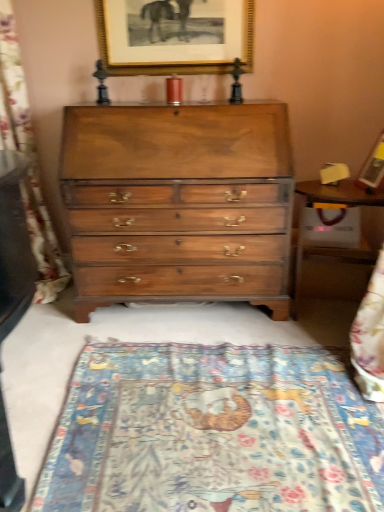
What do you see at coordinates (175, 36) in the screenshot?
I see `gold-framed picture at upper center, which is the 1th picture frame from top to bottom` at bounding box center [175, 36].

What do you see at coordinates (373, 167) in the screenshot? I see `wooden picture frame at upper right, the second picture frame from the back` at bounding box center [373, 167].

This screenshot has width=384, height=512. Find the location of `patterned fabric mat at lower center`. patterned fabric mat at lower center is located at coordinates (213, 432).

Identify the location of wooden table at right. (326, 202).

This screenshot has width=384, height=512. In order to click on gold-framed picture at upper center, which is the 1th picture frame from top to bottom in this screenshot , I will do `click(175, 36)`.

Is point (264, 494) behind point (4, 145)?

No.

Where is `tapestry located on the left of patterned fabric mat at lower center`? The height and width of the screenshot is (512, 384). tapestry located on the left of patterned fabric mat at lower center is located at coordinates (30, 160).

From a real-world perspective, is patterned fabric mat at lower center positioned above or below blue woven tapestry at left?

From a real-world perspective, patterned fabric mat at lower center is physically below blue woven tapestry at left.

Which point is more forward, (362, 199) or (316, 478)?

The point (316, 478) is closer to the camera.

Can you confirm if wooden table at right is shorter than patterned fabric mat at lower center?

No.

In the scene shown: Is wooden table at right wider than patterned fabric mat at lower center?

No.

Measure the distance between wooden picture frame at upper right, which is the 1th picture frame from right to left, and gold-framed picture at upper center, which is the 1th picture frame from top to bottom.

They are 1.16 meters apart.

Is wooden picture frame at upper right, which is the first picture frame from front to back, oriented towards gold-framed picture at upper center, the 2th picture frame positioned from the front?

No.

Considering the positions of point (374, 164) and point (127, 57), is point (374, 164) closer or farther from the camera than point (127, 57)?

Point (374, 164) appears to be farther away from the viewer than point (127, 57).

The width and height of the screenshot is (384, 512). Find the location of `picture frame above the wooden picture frame at upper right, which is the first picture frame from front to back (from a real-world perspective)`. picture frame above the wooden picture frame at upper right, which is the first picture frame from front to back (from a real-world perspective) is located at coordinates (175, 36).

Looking at this image, is gold-framed picture at upper center, which is the 1th picture frame from top to bottom, wider than wooden table at right?

Incorrect, the width of gold-framed picture at upper center, which is the 1th picture frame from top to bottom, does not surpass that of wooden table at right.

Considering the sizes of objects gold-framed picture at upper center, acting as the second picture frame starting from the right, and wooden table at right in the image provided, who is bigger, gold-framed picture at upper center, acting as the second picture frame starting from the right, or wooden table at right?

wooden table at right.

Considering the positions of objects gold-framed picture at upper center, the 2th picture frame when ordered from bottom to top, and wooden table at right in the image provided, who is more to the left, gold-framed picture at upper center, the 2th picture frame when ordered from bottom to top, or wooden table at right?

gold-framed picture at upper center, the 2th picture frame when ordered from bottom to top.

Is gold-framed picture at upper center, the 2th picture frame when ordered from bottom to top, not close to wooden table at right?

Yes, gold-framed picture at upper center, the 2th picture frame when ordered from bottom to top, and wooden table at right are quite far apart.

Is gold-framed picture at upper center, the 2th picture frame when ordered from bottom to top, bigger or smaller than shiny brown wood chest of drawers at center?

In the image, gold-framed picture at upper center, the 2th picture frame when ordered from bottom to top, appears to be smaller than shiny brown wood chest of drawers at center.

Identify the location of the chest of drawers beneath the gold-framed picture at upper center, the 2th picture frame positioned from the front (from a real-world perspective). (179, 202).

Which object is further away from the camera, blue woven tapestry at left or gold-framed picture at upper center, which ranks as the first picture frame in back-to-front order?

gold-framed picture at upper center, which ranks as the first picture frame in back-to-front order.

Measure the distance between blue woven tapestry at left and gold-framed picture at upper center, acting as the second picture frame starting from the right.

blue woven tapestry at left is 32.15 inches from gold-framed picture at upper center, acting as the second picture frame starting from the right.

Does point (2, 138) lie in front of point (233, 25)?

No, (2, 138) is further to viewer.

Considering the relative positions of blue woven tapestry at left and gold-framed picture at upper center, the 2th picture frame when ordered from bottom to top, in the image provided, is blue woven tapestry at left to the right of gold-framed picture at upper center, the 2th picture frame when ordered from bottom to top, from the viewer's perspective?

Incorrect, blue woven tapestry at left is not on the right side of gold-framed picture at upper center, the 2th picture frame when ordered from bottom to top.

Which of these two, patterned fabric mat at lower center or wooden picture frame at upper right, which appears as the second picture frame when viewed from the top, is thinner?

wooden picture frame at upper right, which appears as the second picture frame when viewed from the top.

Identify the location of mat on the left of wooden picture frame at upper right, the second picture frame from the back. The height and width of the screenshot is (512, 384). (213, 432).

Considering the points (180, 441) and (369, 170), which point is behind, point (180, 441) or point (369, 170)?

The point (369, 170) is farther from the camera.

Considering the sizes of patterned fabric mat at lower center and wooden picture frame at upper right, which is the 1th picture frame from right to left, in the image, is patterned fabric mat at lower center taller or shorter than wooden picture frame at upper right, which is the 1th picture frame from right to left,?

In the image, patterned fabric mat at lower center appears to be shorter than wooden picture frame at upper right, which is the 1th picture frame from right to left.

This screenshot has width=384, height=512. I want to click on tapestry that is behind the patterned fabric mat at lower center, so click(x=30, y=160).

The height and width of the screenshot is (512, 384). Find the location of `mat in front of the wooden table at right`. mat in front of the wooden table at right is located at coordinates click(213, 432).

Considering their positions, is blue woven tapestry at left positioned closer to patterned fabric mat at lower center than shiny brown wood chest of drawers at center?

shiny brown wood chest of drawers at center is positioned closer to the anchor patterned fabric mat at lower center.

Estimate the real-world distances between objects in this image. Which object is further from shiny brown wood chest of drawers at center, wooden picture frame at upper right, which appears as the second picture frame when viewed from the top, or blue woven tapestry at left?

Among the two, wooden picture frame at upper right, which appears as the second picture frame when viewed from the top, is located further to shiny brown wood chest of drawers at center.

Based on their spatial positions, is gold-framed picture at upper center, the 2th picture frame positioned from the front, or shiny brown wood chest of drawers at center further from patterned fabric mat at lower center?

Among the two, gold-framed picture at upper center, the 2th picture frame positioned from the front, is located further to patterned fabric mat at lower center.

Considering their positions, is shiny brown wood chest of drawers at center positioned closer to blue woven tapestry at left than patterned fabric mat at lower center?

shiny brown wood chest of drawers at center lies closer to blue woven tapestry at left than the other object.

Considering their positions, is wooden table at right positioned closer to gold-framed picture at upper center, the first picture frame positioned from the left, than blue woven tapestry at left?

The object closer to gold-framed picture at upper center, the first picture frame positioned from the left, is blue woven tapestry at left.

From the image, which object appears to be nearer to gold-framed picture at upper center, which ranks as the first picture frame in back-to-front order, wooden picture frame at upper right, the 1th picture frame from the bottom, or blue woven tapestry at left?

blue woven tapestry at left is positioned closer to the anchor gold-framed picture at upper center, which ranks as the first picture frame in back-to-front order.

When comparing their distances from wooden picture frame at upper right, which is the first picture frame from front to back, does blue woven tapestry at left or shiny brown wood chest of drawers at center seem closer?

shiny brown wood chest of drawers at center.

Looking at the image, which one is located further to wooden table at right, blue woven tapestry at left or shiny brown wood chest of drawers at center?

blue woven tapestry at left.

The image size is (384, 512). I want to click on picture frame between gold-framed picture at upper center, which ranks as the first picture frame in back-to-front order, and patterned fabric mat at lower center in the up-down direction, so click(x=373, y=167).

The height and width of the screenshot is (512, 384). I want to click on chest of drawers between blue woven tapestry at left and wooden table at right in the horizontal direction, so click(x=179, y=202).

Locate an element on the screen. chest of drawers between blue woven tapestry at left and wooden picture frame at upper right, the second picture frame when ordered from left to right, from left to right is located at coordinates click(179, 202).

Image resolution: width=384 pixels, height=512 pixels. In order to click on picture frame between blue woven tapestry at left and wooden picture frame at upper right, the second picture frame when ordered from left to right in this screenshot , I will do `click(175, 36)`.